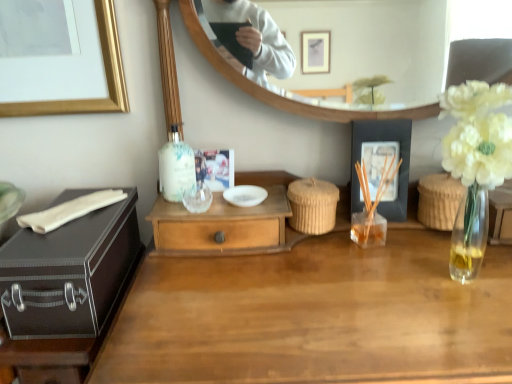
I want to click on free spot above wooden drawer at center (from a real-world perspective), so click(217, 205).